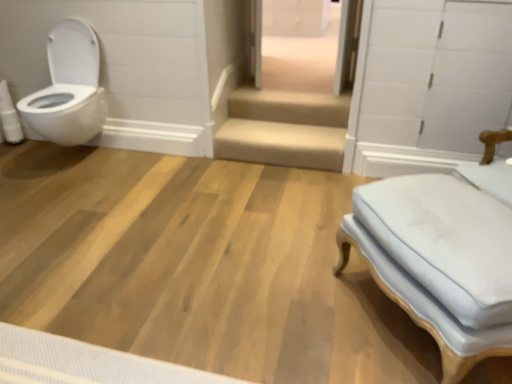
Question: Is white glossy drawer at upper center further to the viewer compared to white glossy toilet at left?

Choices:
 (A) no
 (B) yes

Answer: (B)

Question: Does white glossy drawer at upper center have a greater width compared to white glossy toilet at left?

Choices:
 (A) yes
 (B) no

Answer: (A)

Question: Is white glossy drawer at upper center not close to white glossy toilet at left?

Choices:
 (A) no
 (B) yes

Answer: (B)

Question: Does white glossy drawer at upper center have a greater height compared to white glossy toilet at left?

Choices:
 (A) yes
 (B) no

Answer: (B)

Question: Can you confirm if white glossy drawer at upper center is smaller than white glossy toilet at left?

Choices:
 (A) no
 (B) yes

Answer: (A)

Question: Is white glossy drawer at upper center at the right side of white glossy toilet at left?

Choices:
 (A) no
 (B) yes

Answer: (B)

Question: Is white fabric ottoman at right oriented away from white glossy toilet at left?

Choices:
 (A) yes
 (B) no

Answer: (B)

Question: Considering the relative sizes of white fabric ottoman at right and white glossy toilet at left in the image provided, is white fabric ottoman at right smaller than white glossy toilet at left?

Choices:
 (A) yes
 (B) no

Answer: (B)

Question: Does white fabric ottoman at right have a lesser width compared to white glossy toilet at left?

Choices:
 (A) no
 (B) yes

Answer: (B)

Question: Is white fabric ottoman at right in contact with white glossy toilet at left?

Choices:
 (A) yes
 (B) no

Answer: (B)

Question: Does white fabric ottoman at right appear on the left side of white glossy toilet at left?

Choices:
 (A) no
 (B) yes

Answer: (A)

Question: Does white fabric ottoman at right have a greater height compared to white glossy toilet at left?

Choices:
 (A) yes
 (B) no

Answer: (B)

Question: Does white glossy toilet at left have a smaller size compared to white glossy drawer at upper center?

Choices:
 (A) yes
 (B) no

Answer: (A)